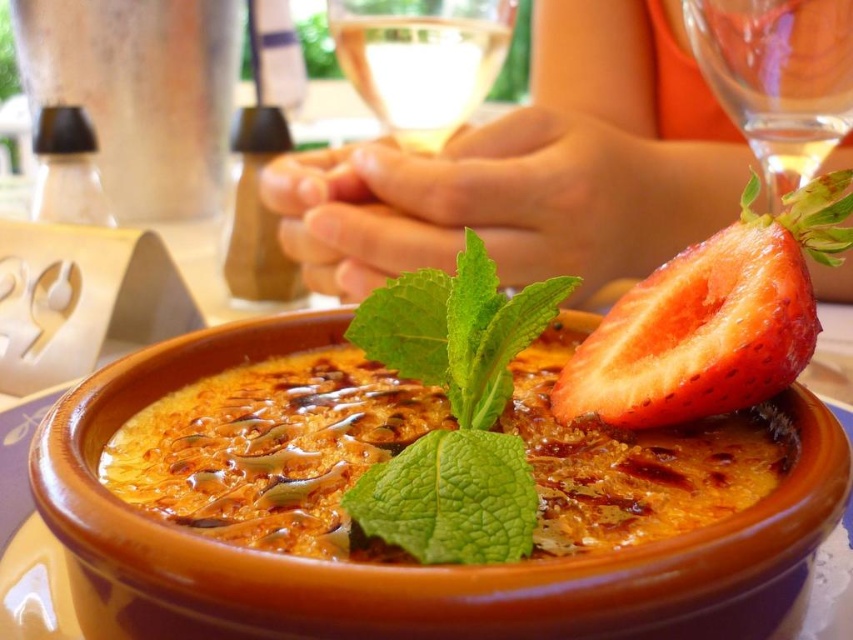
Is red matte strawberry at upper right further to camera compared to green leafy mint at center?

Yes.

Can you confirm if red matte strawberry at upper right is thinner than green leafy mint at center?

Incorrect, red matte strawberry at upper right's width is not less than green leafy mint at center's.

Which is behind, point (729, 340) or point (381, 522)?

Point (729, 340)

Find the location of a particular element. red matte strawberry at upper right is located at coordinates (712, 317).

Does matte clay bowl at center have a greater height compared to red matte strawberry at upper right?

Indeed, matte clay bowl at center has a greater height compared to red matte strawberry at upper right.

Is matte clay bowl at center further to the viewer compared to red matte strawberry at upper right?

No, matte clay bowl at center is in front of red matte strawberry at upper right.

This screenshot has height=640, width=853. I want to click on matte clay bowl at center, so click(407, 566).

This screenshot has width=853, height=640. Identify the location of matte clay bowl at center. (407, 566).

Between matte clay bowl at center and transparent glass at upper right, which one is positioned higher?

transparent glass at upper right is above.

Is matte clay bowl at center positioned at the back of transparent glass at upper right?

No, matte clay bowl at center is in front of transparent glass at upper right.

Who is more forward, (851, 483) or (785, 102)?

Positioned in front is point (851, 483).

You are a GUI agent. You are given a task and a screenshot of the screen. Output one action in this format:
    pyautogui.click(x=<x>, y=<y>)
    Task: Click on the matte clay bowl at center
    Image resolution: width=853 pixels, height=640 pixels.
    Given the screenshot: What is the action you would take?
    pyautogui.click(x=407, y=566)